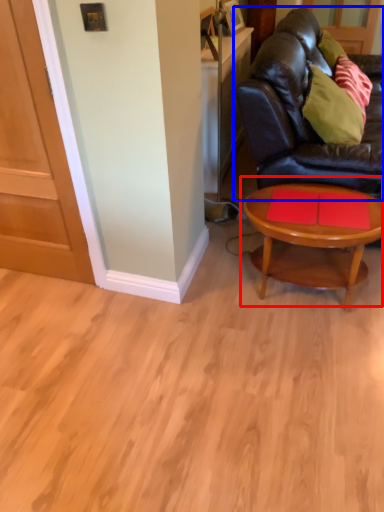
Question: Which of the following is the farthest to the observer, coffee table (highlighted by a red box) or studio couch (highlighted by a blue box)?

Choices:
 (A) coffee table
 (B) studio couch

Answer: (A)